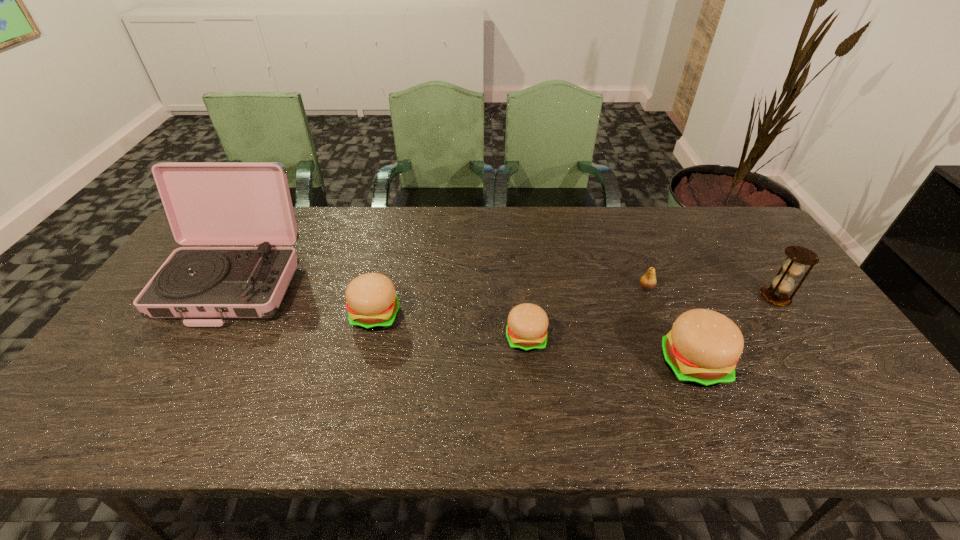
I want to click on free space at the far edge of the desktop, so click(333, 213).

Identify the location of free space at the near edge of the desktop. The width and height of the screenshot is (960, 540). (623, 369).

This screenshot has height=540, width=960. In the image, there is a desktop. In order to click on free space at the right edge in this screenshot , I will do `click(730, 252)`.

Find the location of `unoccupied area between the rightmost hamburger and the shortest hamburger`. unoccupied area between the rightmost hamburger and the shortest hamburger is located at coordinates (610, 351).

Locate an element on the screen. The image size is (960, 540). free space between the pear and the rightmost object is located at coordinates (710, 293).

This screenshot has width=960, height=540. Find the location of `vacant area that lies between the record player and the third shortest object`. vacant area that lies between the record player and the third shortest object is located at coordinates (305, 299).

This screenshot has height=540, width=960. Identify the location of empty space between the rightmost hamburger and the record player. (464, 323).

Identify the location of free area in between the hourglass and the fourth object from right to left. (651, 318).

At what (x,y) coordinates should I click in order to perform the action: click on unoccupied area between the leftmost hamburger and the pear. Please return your answer as a coordinate pair (x, y). Image resolution: width=960 pixels, height=540 pixels. Looking at the image, I should click on (511, 301).

Identify the location of vacant space that is in between the pear and the tallest object. (441, 285).